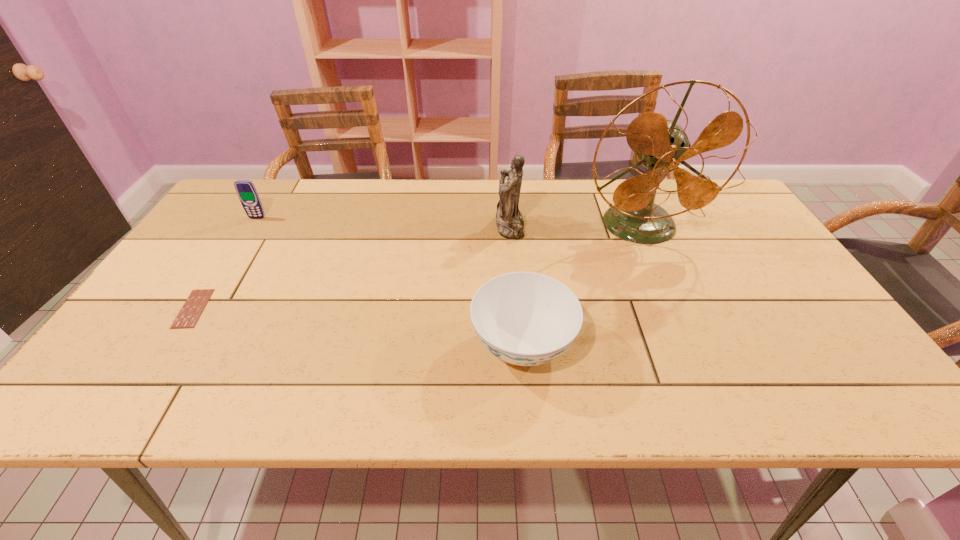
Locate an element on the screen. The image size is (960, 540). object positioned at the far left corner is located at coordinates (246, 191).

Where is `object located at the far right corner`? This screenshot has height=540, width=960. object located at the far right corner is located at coordinates (661, 145).

Find the location of a particular element. free space at the far edge is located at coordinates (552, 179).

In the image, there is a desktop. Find the location of `free region at the near edge`. free region at the near edge is located at coordinates (615, 401).

Identify the location of free location at the left edge of the desktop. Image resolution: width=960 pixels, height=540 pixels. (209, 253).

In the image, there is a desktop. Identify the location of free space at the right edge. The image size is (960, 540). (752, 227).

Identify the location of vacant space at the far left corner. This screenshot has height=540, width=960. (225, 201).

The width and height of the screenshot is (960, 540). Find the location of `vacant area at the far right corner`. vacant area at the far right corner is located at coordinates coord(714,219).

Identify the location of free space between the second tallest object and the shortest object. (351, 267).

Identify the location of vacant area that lies between the cellular telephone and the figurine. This screenshot has height=540, width=960. (383, 222).